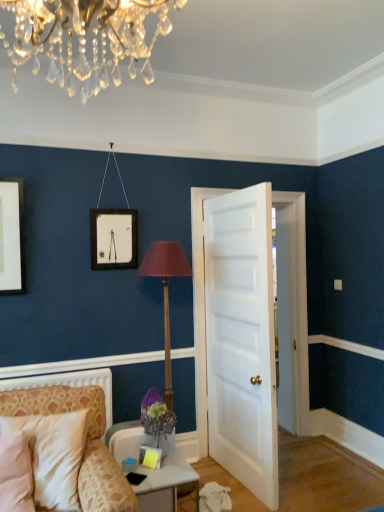
Locate an element on the screen. vacant space to the right of white painted wood door at center is located at coordinates (306, 481).